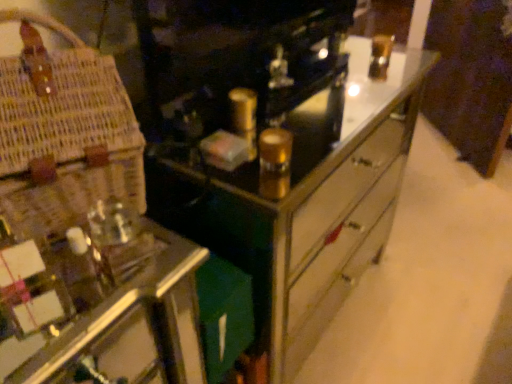
This screenshot has width=512, height=384. Describe the element at coordinates (62, 103) in the screenshot. I see `woven straw basket at left` at that location.

Image resolution: width=512 pixels, height=384 pixels. Identify the location of woven straw basket at left. (62, 103).

Where is `metallic mirrored chest of drawers at center`? The image size is (512, 384). metallic mirrored chest of drawers at center is located at coordinates (284, 196).

Describe the element at coordinates (284, 196) in the screenshot. I see `metallic mirrored chest of drawers at center` at that location.

The height and width of the screenshot is (384, 512). I want to click on woven straw basket at left, so click(62, 103).

Between metallic mirrored chest of drawers at center and woven straw basket at left, which one appears on the left side from the viewer's perspective?

woven straw basket at left is more to the left.

Consider the image. Which object is more forward, metallic mirrored chest of drawers at center or woven straw basket at left?

woven straw basket at left is closer to the camera.

Considering the positions of point (263, 151) and point (58, 60), is point (263, 151) closer or farther from the camera than point (58, 60)?

Clearly, point (263, 151) is more distant from the camera than point (58, 60).

Based on the photo, from the image's perspective, is metallic mirrored chest of drawers at center under woven straw basket at left?

Yes, from the image's perspective, metallic mirrored chest of drawers at center is below woven straw basket at left.

From a real-world perspective, which is physically below, metallic mirrored chest of drawers at center or woven straw basket at left?

metallic mirrored chest of drawers at center.

Which object is thinner, metallic mirrored chest of drawers at center or woven straw basket at left?

Thinner between the two is woven straw basket at left.

Considering the sizes of objects metallic mirrored chest of drawers at center and woven straw basket at left in the image provided, who is taller, metallic mirrored chest of drawers at center or woven straw basket at left?

metallic mirrored chest of drawers at center.

Considering the relative sizes of metallic mirrored chest of drawers at center and woven straw basket at left in the image provided, is metallic mirrored chest of drawers at center bigger than woven straw basket at left?

Yes.

Is woven straw basket at left inside metallic mirrored chest of drawers at center?

No, woven straw basket at left is located outside of metallic mirrored chest of drawers at center.

In the scene shown: Are metallic mirrored chest of drawers at center and woven straw basket at left making contact?

No, metallic mirrored chest of drawers at center is not beside woven straw basket at left.

Is woven straw basket at left at the back of metallic mirrored chest of drawers at center?

metallic mirrored chest of drawers at center does not have its back to woven straw basket at left.

At what (x,y) coordinates should I click in order to perform the action: click on the chest of drawers beneath the woven straw basket at left (from a real-world perspective). Please return your answer as a coordinate pair (x, y). The height and width of the screenshot is (384, 512). Looking at the image, I should click on (284, 196).

Between woven straw basket at left and metallic mirrored chest of drawers at center, which one appears on the right side from the viewer's perspective?

metallic mirrored chest of drawers at center is more to the right.

Does woven straw basket at left lie in front of metallic mirrored chest of drawers at center?

Yes, the depth of woven straw basket at left is less than that of metallic mirrored chest of drawers at center.

Is point (64, 143) less distant than point (298, 160)?

Yes, it is in front of point (298, 160).

From the image's perspective, is woven straw basket at left located above metallic mirrored chest of drawers at center?

Yes, from the image's perspective, woven straw basket at left is on top of metallic mirrored chest of drawers at center.

From a real-world perspective, relative to metallic mirrored chest of drawers at center, is woven straw basket at left vertically above or below?

Clearly, from a real-world perspective, woven straw basket at left is above metallic mirrored chest of drawers at center.

Is woven straw basket at left wider than metallic mirrored chest of drawers at center?

In fact, woven straw basket at left might be narrower than metallic mirrored chest of drawers at center.

Looking at this image, who is taller, woven straw basket at left or metallic mirrored chest of drawers at center?

metallic mirrored chest of drawers at center.

Considering the sizes of objects woven straw basket at left and metallic mirrored chest of drawers at center in the image provided, who is smaller, woven straw basket at left or metallic mirrored chest of drawers at center?

Smaller between the two is woven straw basket at left.

Choose the correct answer: Is woven straw basket at left inside metallic mirrored chest of drawers at center or outside it?

The correct answer is: outside.

Is there a large distance between woven straw basket at left and metallic mirrored chest of drawers at center?

No, woven straw basket at left is in close proximity to metallic mirrored chest of drawers at center.

Is woven straw basket at left positioned with its back to metallic mirrored chest of drawers at center?

No, woven straw basket at left is not facing the opposite direction of metallic mirrored chest of drawers at center.

Can you tell me how much woven straw basket at left and metallic mirrored chest of drawers at center differ in facing direction?

23.2 degrees separate the facing orientations of woven straw basket at left and metallic mirrored chest of drawers at center.

At what (x,y) coordinates should I click in order to perform the action: click on the chest of drawers located underneath the woven straw basket at left (from a real-world perspective). Please return your answer as a coordinate pair (x, y). This screenshot has width=512, height=384. Looking at the image, I should click on (284, 196).

Locate an element on the screen. This screenshot has height=384, width=512. basket above the metallic mirrored chest of drawers at center (from the image's perspective) is located at coordinates (62, 103).

The height and width of the screenshot is (384, 512). What are the coordinates of `the chest of drawers located behind the woven straw basket at left` in the screenshot? It's located at (284, 196).